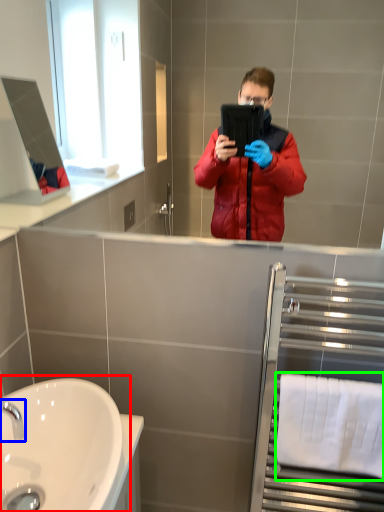
Question: Considering the real-world distances, which object is closest to sink (highlighted by a red box)? tap (highlighted by a blue box) or towel bar (highlighted by a green box).

Choices:
 (A) tap
 (B) towel bar

Answer: (A)